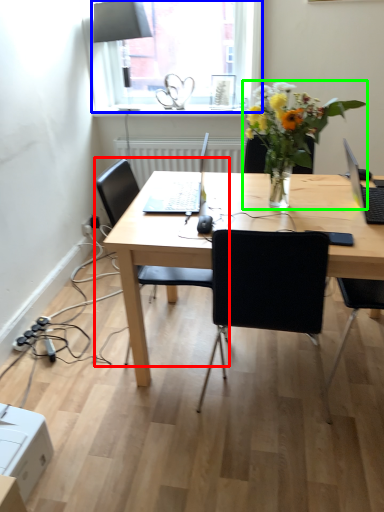
Question: Which object is positioned closest to chair (highlighted by a red box)? Select from window (highlighted by a blue box) and houseplant (highlighted by a green box).

Choices:
 (A) window
 (B) houseplant

Answer: (B)